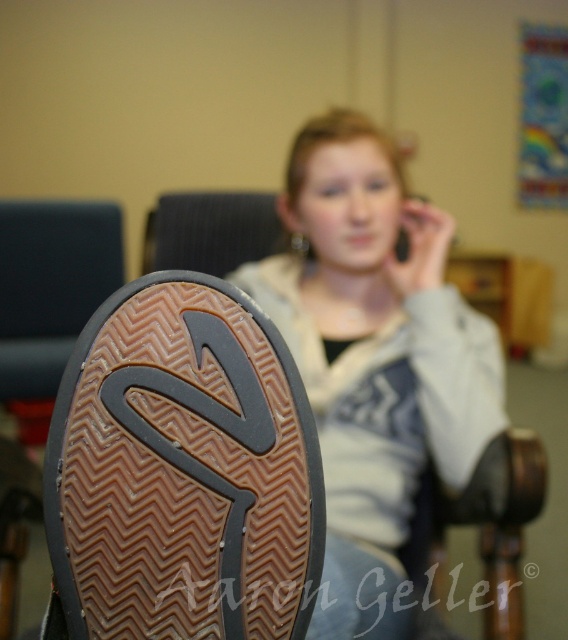
Based on the scene description, where is the brown rubber shoe at lower left located in the image?

The brown rubber shoe at lower left is located at point (183, 470).

You are a delivery person who needs to place a brown rubber shoe at lower left on a shelf that is 16 inches wide. Can the shoe fit on the shelf?

The brown rubber shoe at lower left is 18.45 inches in width, so it cannot fit on a 16 inch wide shelf. Please choose a wider shelf.

You are standing in a room and see the brown rubber shoe at lower left and the matte gray hoodie at center. Which object is positioned more to the left side of the room?

The brown rubber shoe at lower left is positioned more to the left side of the room than the matte gray hoodie at center.